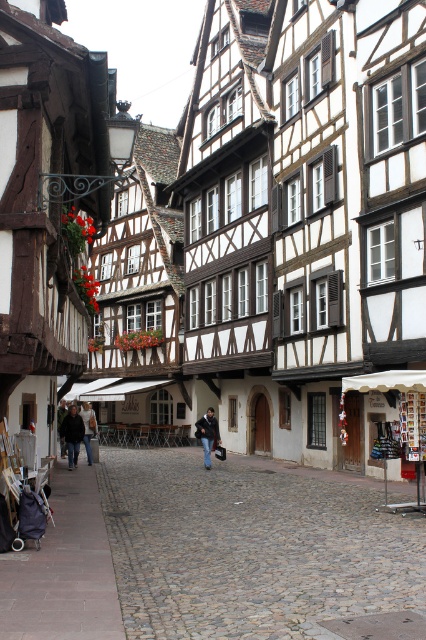
You are standing at the market stall with a white canopy on the left side of the street. Looking towards the center of the street, you see a point marked at coordinates (218, 550). What is located at that point?

The point at coordinates (218, 550) indicates the cobblestone street at center.

You are standing at the entrance of the historic European town street. There is a dark purple fabric baby carriage at lower left located at point [31,516]. If you want to take a photo of the baby carriage without including the market stall with white canopy on the left side, where should you position yourself relative to the baby carriage?

To take a photo of the dark purple fabric baby carriage at lower left located at point [31,516] without including the market stall with white canopy on the left side, you should position yourself to the right side of the baby carriage. This way, the market stall will be out of the frame.